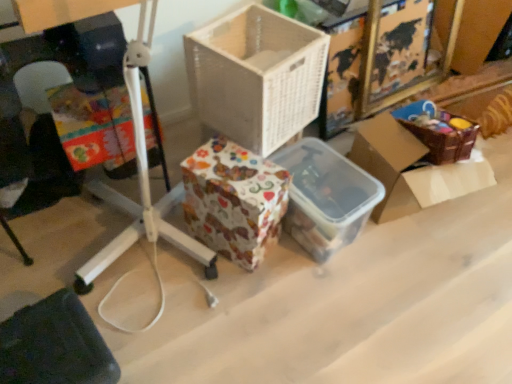
You are a GUI agent. You are given a task and a screenshot of the screen. Output one action in this format:
    pyautogui.click(x=<x>, y=<y>)
    Task: Click on the vacant space situated above patterned paper storage box at center, which ranks as the 1th storage box in left-to-right order (from a real-world perspective)
    The image size is (512, 384).
    Given the screenshot: What is the action you would take?
    pyautogui.click(x=237, y=168)